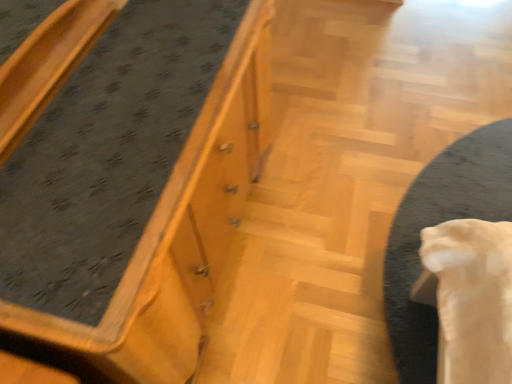
This screenshot has height=384, width=512. What do you see at coordinates (441, 221) in the screenshot? I see `white fabric cushion at lower right` at bounding box center [441, 221].

You are a GUI agent. You are given a task and a screenshot of the screen. Output one action in this format:
    pyautogui.click(x=<x>, y=<y>)
    Task: Click on the white fabric cushion at lower right
    Image resolution: width=512 pixels, height=384 pixels.
    Given the screenshot: What is the action you would take?
    pyautogui.click(x=441, y=221)

Identify the location of white fabric cushion at lower right. This screenshot has width=512, height=384. (441, 221).